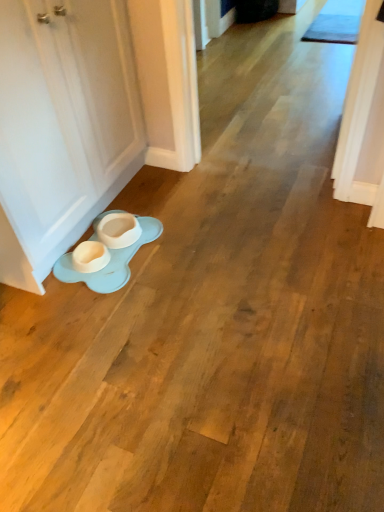
Question: Can you confirm if white matte door at lower left is bigger than light blue rubber saucer at lower left?

Choices:
 (A) yes
 (B) no

Answer: (A)

Question: From the image's perspective, is white matte door at lower left above light blue rubber saucer at lower left?

Choices:
 (A) yes
 (B) no

Answer: (A)

Question: Does white matte door at lower left touch light blue rubber saucer at lower left?

Choices:
 (A) yes
 (B) no

Answer: (B)

Question: Does white matte door at lower left have a lesser height compared to light blue rubber saucer at lower left?

Choices:
 (A) no
 (B) yes

Answer: (A)

Question: From a real-world perspective, does white matte door at lower left stand above light blue rubber saucer at lower left?

Choices:
 (A) yes
 (B) no

Answer: (A)

Question: Does white matte door at lower left appear on the left side of light blue rubber saucer at lower left?

Choices:
 (A) yes
 (B) no

Answer: (A)

Question: Does light blue rubber saucer at lower left have a greater width compared to white matte door at lower left?

Choices:
 (A) yes
 (B) no

Answer: (A)

Question: From the image's perspective, does light blue rubber saucer at lower left appear lower than white matte door at lower left?

Choices:
 (A) yes
 (B) no

Answer: (A)

Question: From a real-world perspective, is light blue rubber saucer at lower left beneath white matte door at lower left?

Choices:
 (A) yes
 (B) no

Answer: (A)

Question: Is light blue rubber saucer at lower left facing away from white matte door at lower left?

Choices:
 (A) yes
 (B) no

Answer: (B)

Question: Would you consider light blue rubber saucer at lower left to be distant from white matte door at lower left?

Choices:
 (A) yes
 (B) no

Answer: (B)

Question: From a real-world perspective, is light blue rubber saucer at lower left physically above white matte door at lower left?

Choices:
 (A) no
 (B) yes

Answer: (A)

Question: Considering the positions of white matte door at lower left and light blue rubber saucer at lower left in the image, is white matte door at lower left wider or thinner than light blue rubber saucer at lower left?

Choices:
 (A) wide
 (B) thin

Answer: (B)